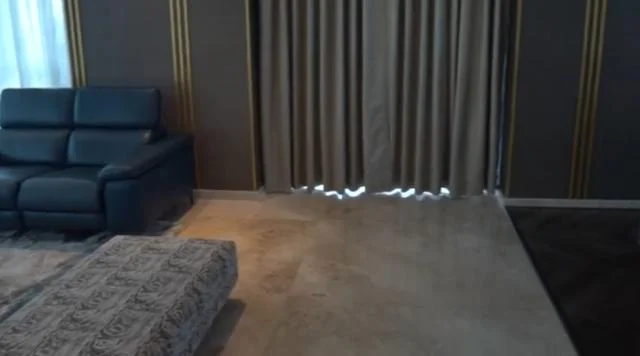
Locate an element on the screen. The width and height of the screenshot is (640, 356). ottoman is located at coordinates (187, 264).